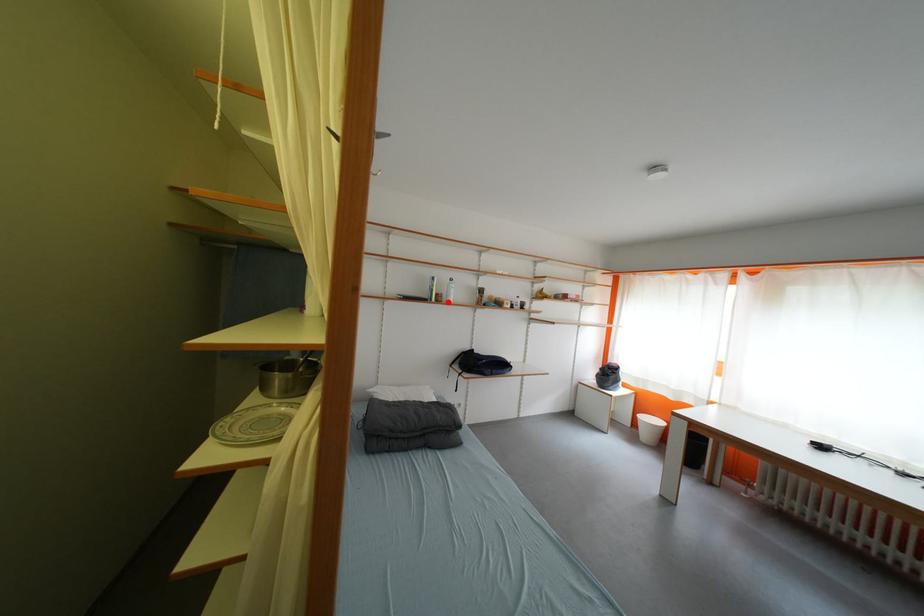
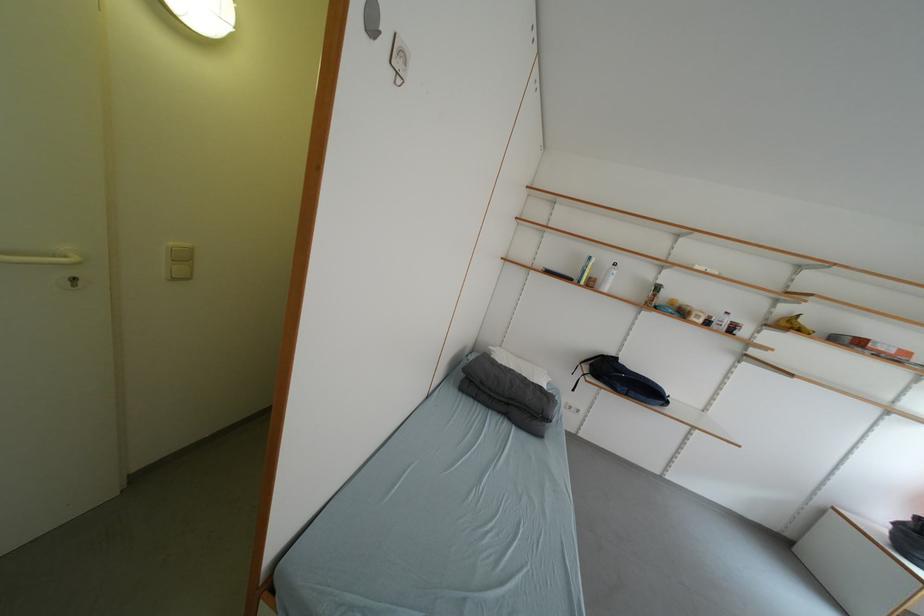
In the second image, find the point that corresponds to the highlighted location in the first image.

(600, 286)